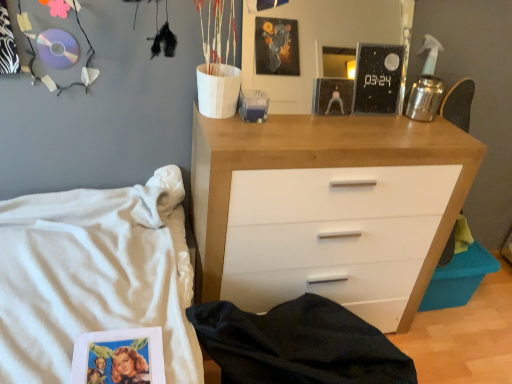
Identify the location of vacant area that is in front of black glossy clock at upper center. The image size is (512, 384). (371, 126).